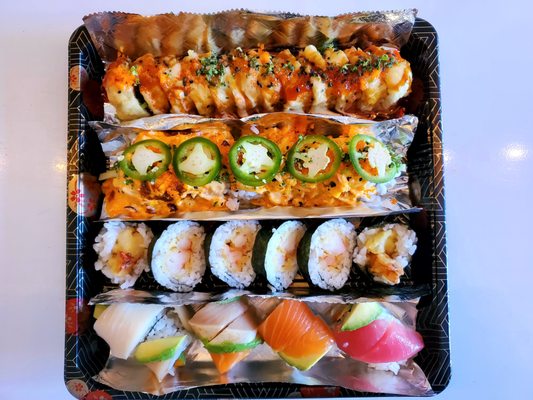
This screenshot has width=533, height=400. Identify the location of divider. (387, 295), (375, 212), (362, 121).